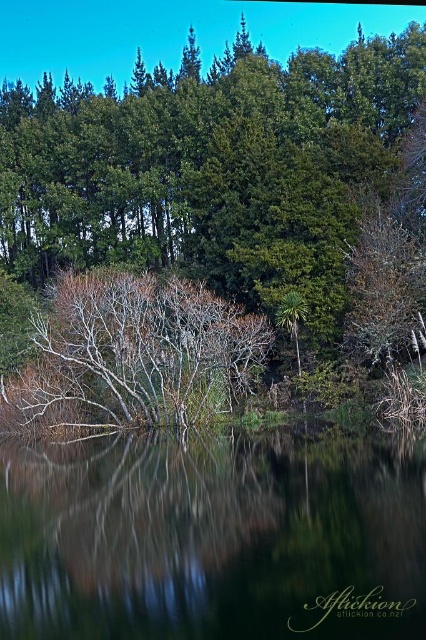
Question: Can you confirm if green leafy tree at center is bigger than transparent water at center?

Choices:
 (A) no
 (B) yes

Answer: (B)

Question: Which is farther from the bare branches at center?

Choices:
 (A) green leafy tree at center
 (B) transparent water at center

Answer: (A)

Question: Which point is farther to the camera?

Choices:
 (A) (181, 593)
 (B) (319, 77)
 (C) (195, 397)

Answer: (B)

Question: Can you confirm if green leafy tree at center is positioned to the right of bare branches at center?

Choices:
 (A) no
 (B) yes

Answer: (B)

Question: Which is nearer to the green leafy tree at center?

Choices:
 (A) bare branches at center
 (B) transparent water at center

Answer: (A)

Question: Does transparent water at center come in front of bare branches at center?

Choices:
 (A) no
 (B) yes

Answer: (B)